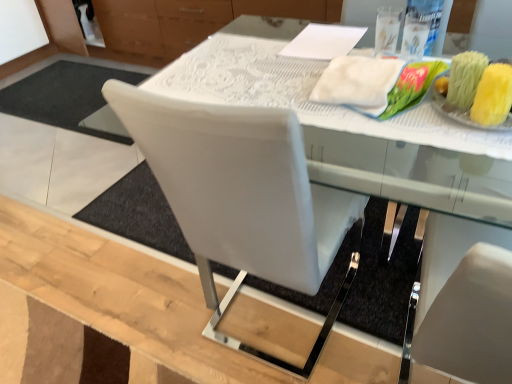
This screenshot has height=384, width=512. What do you see at coordinates (358, 83) in the screenshot?
I see `white fluffy cloth at upper right` at bounding box center [358, 83].

The width and height of the screenshot is (512, 384). I want to click on white lace tablecloth at center, so (x=354, y=134).

Where is `white leather chair at center`? This screenshot has width=512, height=384. white leather chair at center is located at coordinates (242, 198).

What is the approximate width of white leather chair at center?

24.82 inches.

At what (x,y) coordinates should I click in order to perform the action: click on white fluffy cloth at upper right. Please return your answer as a coordinate pair (x, y). Looking at the image, I should click on (358, 83).

Can white fluffy cloth at upper right be found inside white leather chair at center?

Yes, white leather chair at center is surrounding white fluffy cloth at upper right.

What's the angular difference between white leather chair at center and white fluffy cloth at upper right's facing directions?

The facing directions of white leather chair at center and white fluffy cloth at upper right are 179 degrees apart.

Find the location of a particular element. cloth above the white leather chair at center (from the image's perspective) is located at coordinates (358, 83).

Can you confirm if white leather chair at center is thinner than white fluffy cloth at upper right?

No.

Can you tell me how much white fluffy cloth at upper right and white lace tablecloth at center differ in facing direction?

They differ by 0.127 degrees in their facing directions.

Is white fluffy cloth at upper right spatially inside white lace tablecloth at center, or outside of it?

The correct answer is: outside.

From the image's perspective, is white fluffy cloth at upper right located above or below white lace tablecloth at center?

white fluffy cloth at upper right is below white lace tablecloth at center.

From a real-world perspective, is white fluffy cloth at upper right physically located above or below white lace tablecloth at center?

white fluffy cloth at upper right is situated higher than white lace tablecloth at center in the real world.

Which is more to the right, white leather chair at center or white lace tablecloth at center?

white lace tablecloth at center is more to the right.

Find the location of a particular element. This screenshot has width=512, height=384. round table that appears on the right of white leather chair at center is located at coordinates (354, 134).

Which point is more distant from viewer, [206,290] or [452,160]?

The point [206,290] is behind.

Considering the relative positions of white lace tablecloth at center and white fluffy cloth at upper right in the image provided, is white lace tablecloth at center behind white fluffy cloth at upper right?

No, the depth of white lace tablecloth at center is less than that of white fluffy cloth at upper right.

This screenshot has height=384, width=512. In order to click on cloth on the right of white lace tablecloth at center in this screenshot , I will do [x=358, y=83].

From the picture: Is white lace tablecloth at center with white fluffy cloth at upper right?

No, white lace tablecloth at center is not next to white fluffy cloth at upper right.

From a real-world perspective, is white lace tablecloth at center physically located above or below white fluffy cloth at upper right?

white lace tablecloth at center is situated lower than white fluffy cloth at upper right in the real world.

Looking at this image, does white fluffy cloth at upper right have a lesser width compared to white leather chair at center?

Correct, the width of white fluffy cloth at upper right is less than that of white leather chair at center.

Can you tell me how much white fluffy cloth at upper right and white leather chair at center differ in facing direction?

white fluffy cloth at upper right and white leather chair at center are facing 179 degrees away from each other.

Based on the photo, considering the sizes of objects white fluffy cloth at upper right and white leather chair at center in the image provided, who is smaller, white fluffy cloth at upper right or white leather chair at center?

white fluffy cloth at upper right is smaller.

There is a white leather chair at center. At what (x,y) coordinates should I click in order to perform the action: click on cloth above it (from a real-world perspective). Please return your answer as a coordinate pair (x, y). The height and width of the screenshot is (384, 512). Looking at the image, I should click on (358, 83).

Considering the positions of point (416, 162) and point (219, 193), is point (416, 162) closer or farther from the camera than point (219, 193)?

Point (416, 162) is positioned farther from the camera compared to point (219, 193).

Which of these two, white lace tablecloth at center or white leather chair at center, is thinner?

white lace tablecloth at center is thinner.

Considering the relative sizes of white lace tablecloth at center and white leather chair at center in the image provided, is white lace tablecloth at center bigger than white leather chair at center?

Incorrect, white lace tablecloth at center is not larger than white leather chair at center.

From a real-world perspective, which object rests below the other?

white leather chair at center, from a real-world perspective.

Identify the location of chair in front of the white fluffy cloth at upper right. The height and width of the screenshot is (384, 512). (242, 198).

The image size is (512, 384). Identify the location of round table that appears on the left of white fluffy cloth at upper right. (354, 134).

Looking at the image, which one is located further to white lace tablecloth at center, white leather chair at center or white fluffy cloth at upper right?

white leather chair at center lies further to white lace tablecloth at center than the other object.

Estimate the real-world distances between objects in this image. Which object is further from white lace tablecloth at center, white fluffy cloth at upper right or white leather chair at center?

white leather chair at center is positioned further to the anchor white lace tablecloth at center.

Which object lies nearer to the anchor point white fluffy cloth at upper right, white lace tablecloth at center or white leather chair at center?

white lace tablecloth at center is closer to white fluffy cloth at upper right.

Based on their spatial positions, is white lace tablecloth at center or white fluffy cloth at upper right closer to white leather chair at center?

Among the two, white lace tablecloth at center is located nearer to white leather chair at center.

Based on their spatial positions, is white fluffy cloth at upper right or white lace tablecloth at center further from white leather chair at center?

white fluffy cloth at upper right lies further to white leather chair at center than the other object.

Based on their spatial positions, is white leather chair at center or white lace tablecloth at center closer to white fluffy cloth at upper right?

Among the two, white lace tablecloth at center is located nearer to white fluffy cloth at upper right.

Locate an element on the screen. This screenshot has height=384, width=512. cloth that lies between white lace tablecloth at center and white leather chair at center from top to bottom is located at coordinates (358, 83).